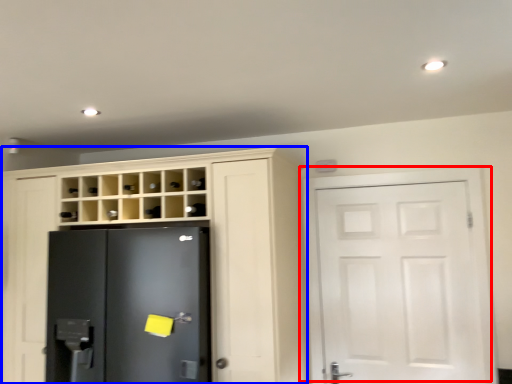
Question: Which object is further to the camera taking this photo, door (highlighted by a red box) or cupboard (highlighted by a blue box)?

Choices:
 (A) door
 (B) cupboard

Answer: (A)